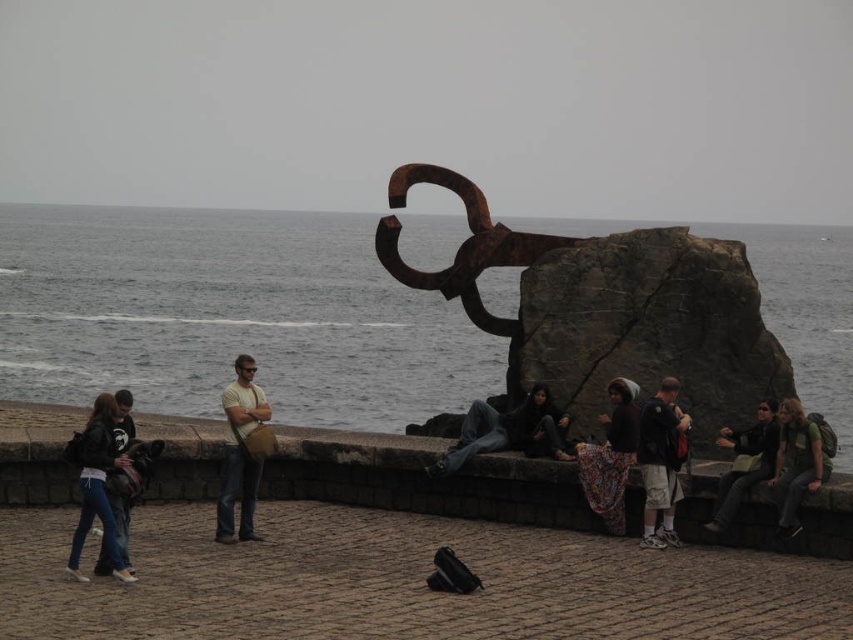
Question: Which of the following is the farthest from the observer?

Choices:
 (A) pyautogui.click(x=543, y=406)
 (B) pyautogui.click(x=648, y=444)
 (C) pyautogui.click(x=228, y=502)

Answer: (A)

Question: Which of the following is the farthest from the observer?

Choices:
 (A) (247, 499)
 (B) (585, 349)
 (C) (722, 483)

Answer: (B)

Question: Is light brown leather bag at center smaller than floral fabric scarf at center?

Choices:
 (A) yes
 (B) no

Answer: (B)

Question: In this image, where is rusty metal hook at center located relative to dark gray shorts at center?

Choices:
 (A) above
 (B) below

Answer: (A)

Question: Which point is closer to the camera?

Choices:
 (A) gray water at upper center
 (B) rusty metal hook at center

Answer: (B)

Question: Is dark gray shorts at center bigger than floral fabric scarf at center?

Choices:
 (A) yes
 (B) no

Answer: (B)